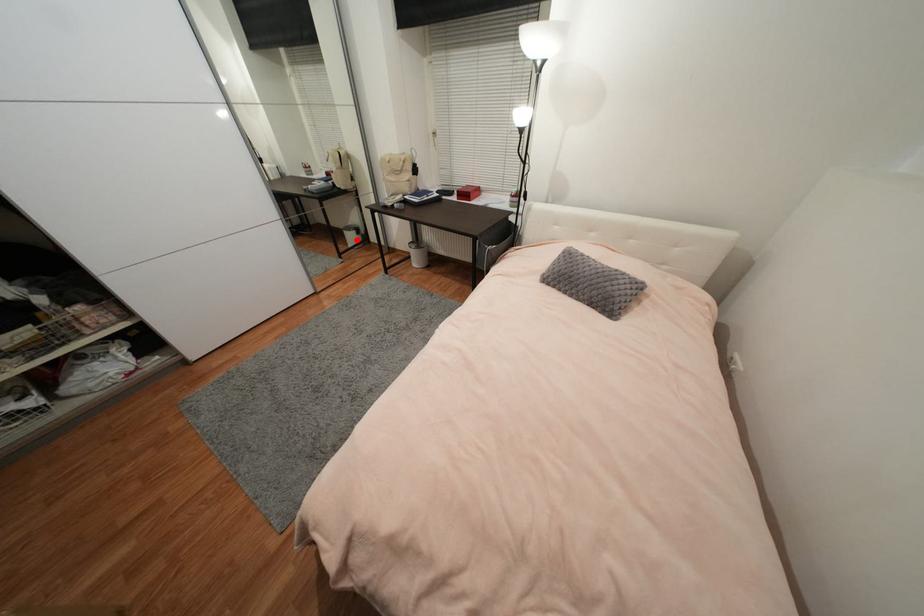
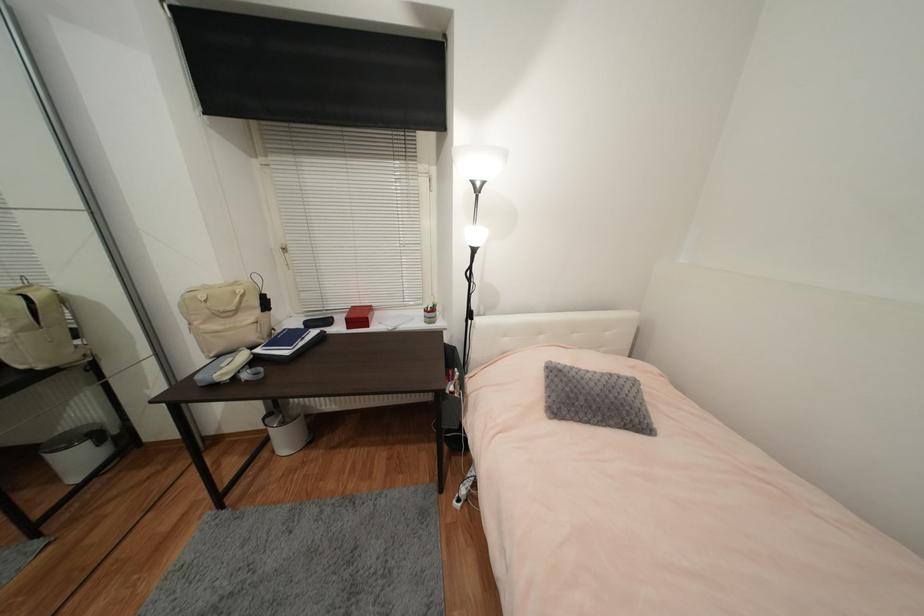
Question: I am providing you with two images of the same scene from different viewpoints. Image1 has a red point marked. In image2, the corresponding 3D location appears at what relative position? Reply with the corresponding letter.

Choices:
 (A) Closer
 (B) Farther

Answer: (B)